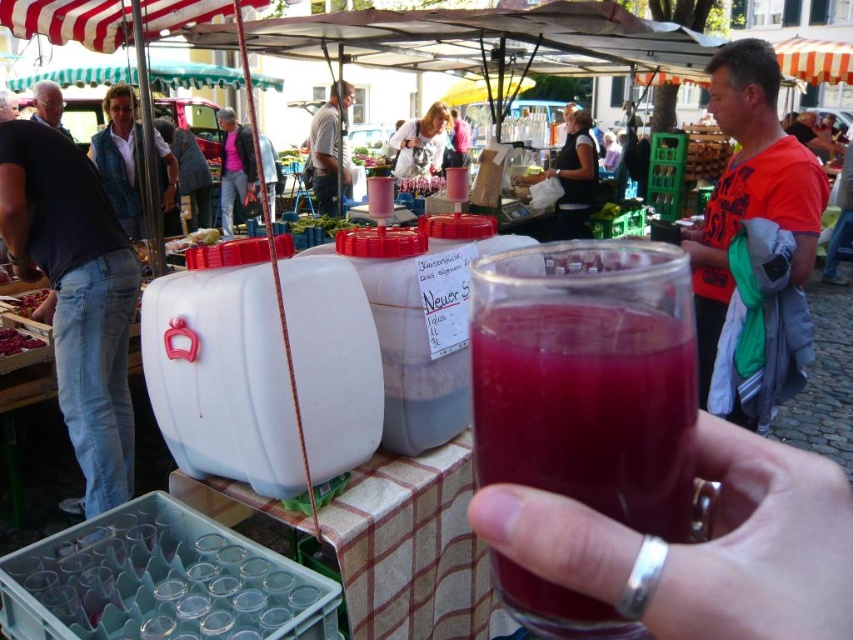
Does jeans at left come in front of smooth red berries at lower left?

Yes, jeans at left is in front of smooth red berries at lower left.

Is point (74, 452) behind point (15, 304)?

That is False.

The width and height of the screenshot is (853, 640). Identify the location of jeans at left. (74, 292).

Where is `orange cotton shirt at upper center`? The width and height of the screenshot is (853, 640). orange cotton shirt at upper center is located at coordinates (749, 186).

Which is behind, point (705, 282) or point (51, 113)?

The point (51, 113) is behind.

You are a GUI agent. You are given a task and a screenshot of the screen. Output one action in this format:
    pyautogui.click(x=<x>, y=<y>)
    Task: Click on the orange cotton shirt at upper center
    This screenshot has height=640, width=853.
    Given the screenshot: What is the action you would take?
    (749, 186)

Who is more forward, (x=401, y=144) or (x=62, y=129)?

Point (x=62, y=129) is in front.

From the picture: Is matte black shirt at center below gray hair at upper left?

Actually, matte black shirt at center is above gray hair at upper left.

Is point (415, 144) more distant than point (61, 113)?

That is True.

I want to click on matte black shirt at center, so click(421, 141).